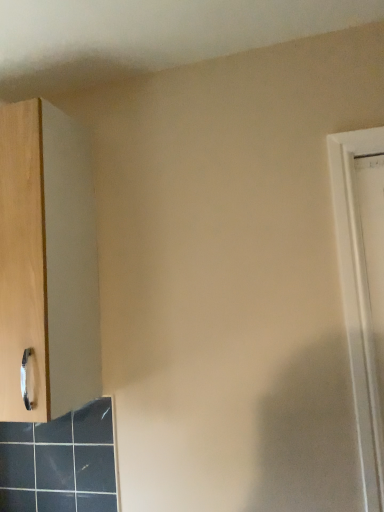
Locate an element on the screen. light wood cabinet at left is located at coordinates (47, 263).

Measure the distance between light wood cabinet at left and camera.

light wood cabinet at left and camera are 3.74 feet apart from each other.

The width and height of the screenshot is (384, 512). What do you see at coordinates (47, 263) in the screenshot? I see `light wood cabinet at left` at bounding box center [47, 263].

What is the approximate width of light wood cabinet at left?

It is 14.09 inches.

The height and width of the screenshot is (512, 384). Find the location of `light wood cabinet at left`. light wood cabinet at left is located at coordinates (47, 263).